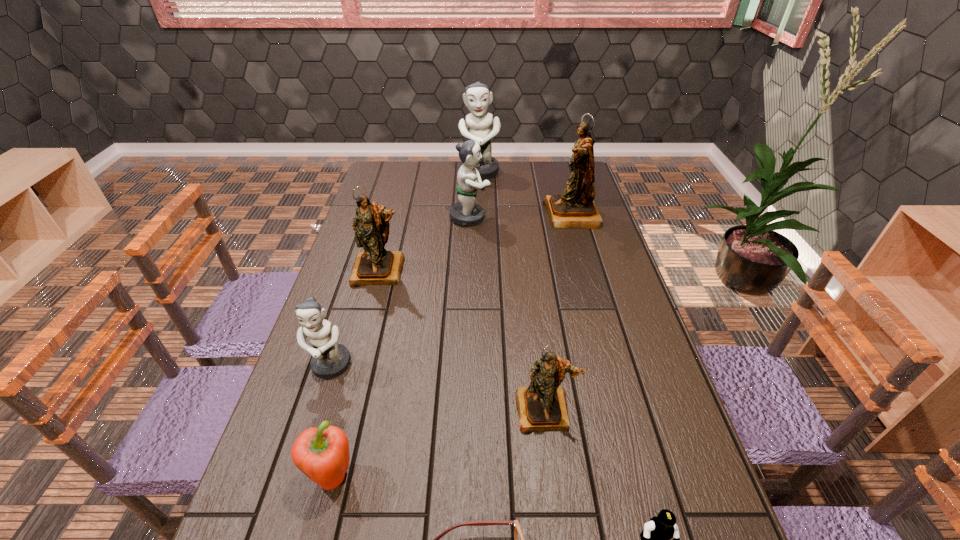
Where is `the second nearest figurine`? the second nearest figurine is located at coordinates (329, 359).

Identify the location of orange pepper. The width and height of the screenshot is (960, 540). (322, 454).

Locate an element on the screen. the seventh tallest object is located at coordinates (322, 454).

Locate an element on the screen. The height and width of the screenshot is (540, 960). vacant area situated 0.060m on the front-facing side of the farthest object is located at coordinates (480, 191).

You are a GUI agent. You are given a task and a screenshot of the screen. Output one action in this format:
    pyautogui.click(x=<x>, y=<y>)
    Task: Click on the vacant space situated 0.340m on the front-facing side of the farthest gold figurine
    Image resolution: width=960 pixels, height=540 pixels.
    Given the screenshot: What is the action you would take?
    pyautogui.click(x=454, y=215)

Identify the location of vacant region located on the front-facing side of the farthest gold figurine. This screenshot has width=960, height=540. (497, 215).

Locate an element on the screen. free space located 0.070m on the front-facing side of the farthest gold figurine is located at coordinates (526, 215).

Find the location of a particular element. free location located 0.200m on the front-facing side of the second farthest green figurine is located at coordinates (544, 217).

This screenshot has height=540, width=960. Find the location of `blank area located 0.390m on the front-facing side of the second farthest gold figurine`. blank area located 0.390m on the front-facing side of the second farthest gold figurine is located at coordinates (347, 397).

At what (x,y) coordinates should I click in order to perform the action: click on free space located on the front-facing side of the nearest gold figurine. Please return your answer as a coordinate pair (x, y). Looking at the image, I should click on (561, 532).